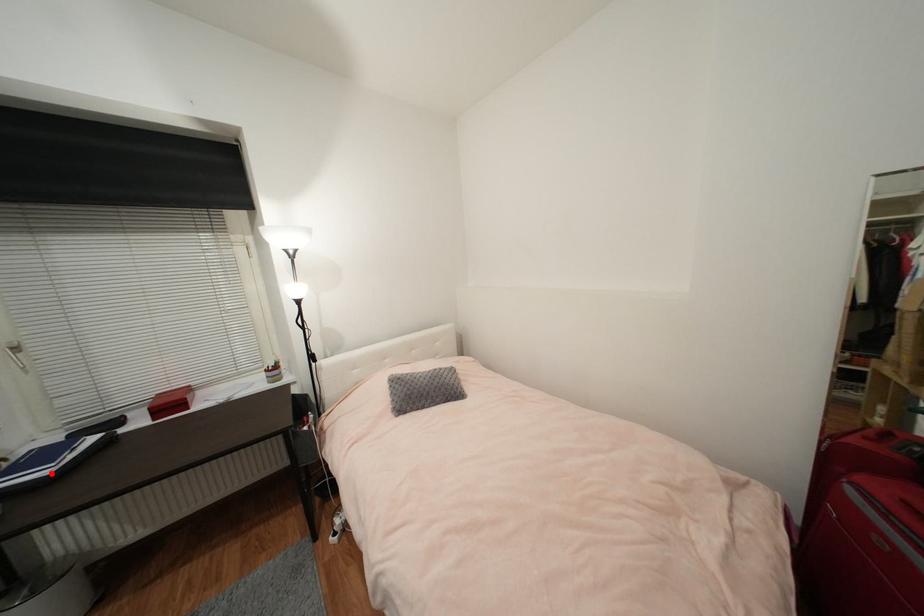
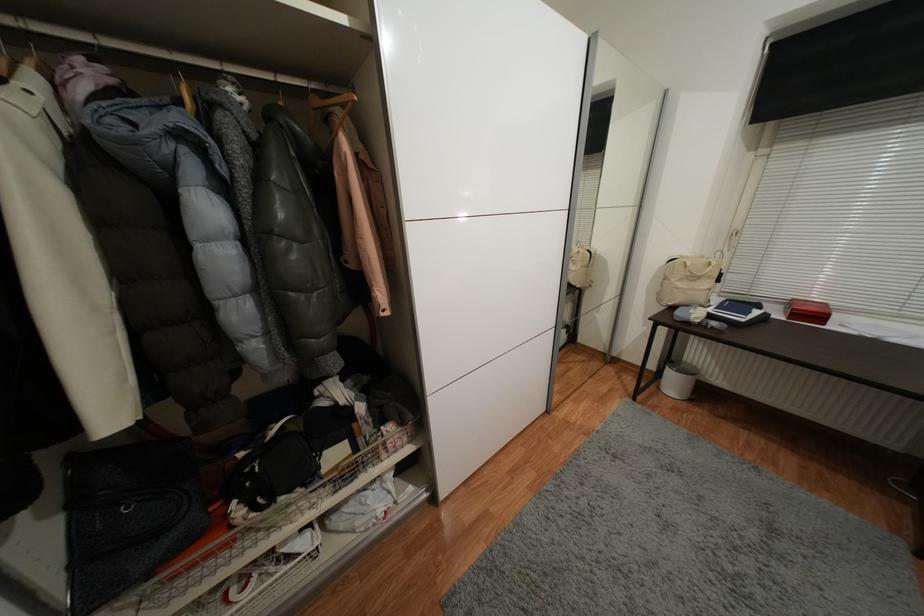
Locate, in the second image, the point that corresponds to the highlighted location in the first image.

(747, 321)